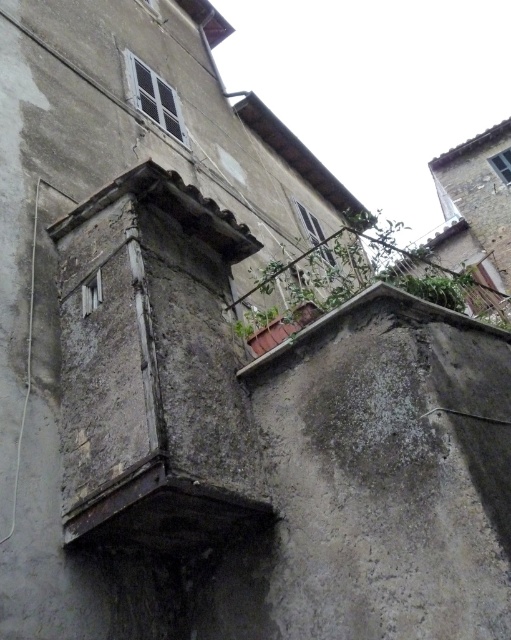
You are a painter standing on the ground level looking at the building. You need to decide which object, the rustic concrete ledge at center or the green leafy plant at upper right, is closer to the ground. Based on their heights, which one is lower?

The rustic concrete ledge at center has a lesser height compared to the green leafy plant at upper right, so the rustic concrete ledge at center is closer to the ground.

You are standing on the balcony of the old building and notice the rustic concrete ledge at center and the green leafy plant at upper right. Which object is positioned to the left of the other?

The rustic concrete ledge at center is to the left of the green leafy plant at upper right.

You are standing in front of the old building and want to place a small potted plant on the rustic concrete ledge at center. However, you notice the green leafy plant at upper right nearby. Which object is closer to you, the observer?

The rustic concrete ledge at center is closer to you because it is in front of the green leafy plant at upper right.